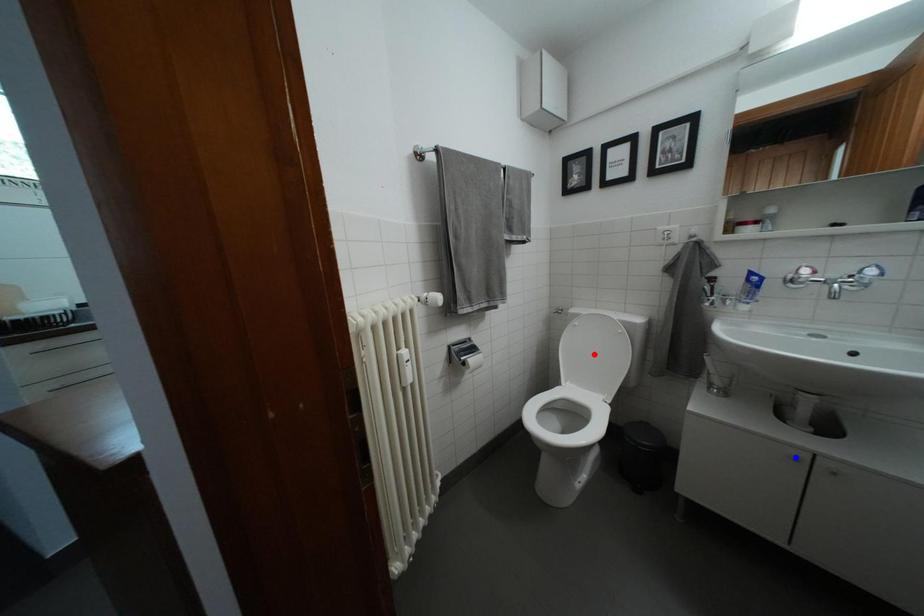
Question: In the image, two points are highlighted. Which point is nearer to the camera? Reply with the corresponding letter.

Choices:
 (A) blue point
 (B) red point

Answer: (A)